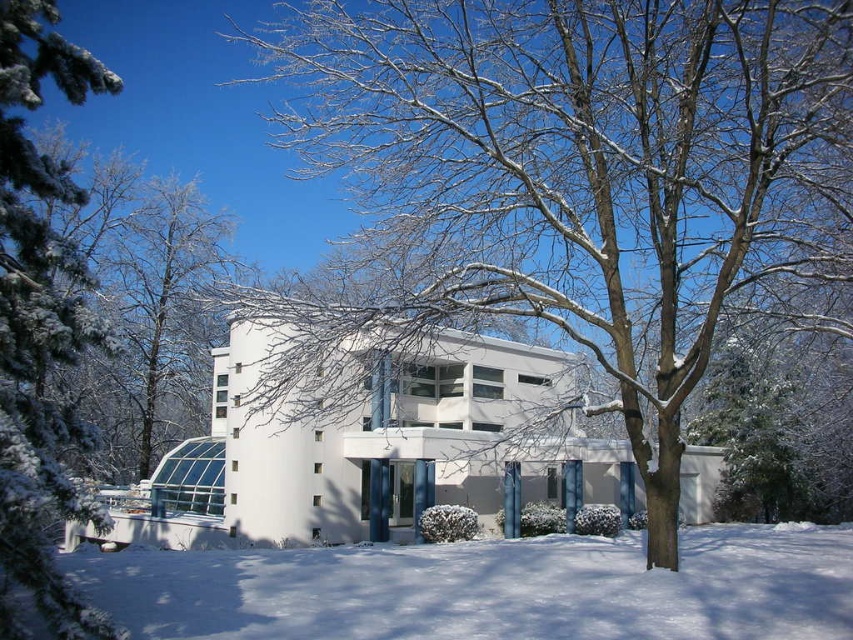
Find the location of `snow-covered tree at center`. snow-covered tree at center is located at coordinates (560, 182).

Who is higher up, snow-covered tree at center or white powdery snow at lower center?

snow-covered tree at center is above.

Does point (457, 88) lie in front of point (289, 568)?

No.

Image resolution: width=853 pixels, height=640 pixels. I want to click on snow-covered tree at center, so pyautogui.click(x=560, y=182).

Does snow-covered tree at center have a lesser width compared to green textured pine at left?

Correct, snow-covered tree at center's width is less than green textured pine at left's.

Where is `snow-covered tree at center`? snow-covered tree at center is located at coordinates (560, 182).

Between point (489, 282) and point (57, 636), which one is positioned behind?

Point (489, 282)

In order to click on snow-covered tree at center in this screenshot , I will do `click(560, 182)`.

Is white powdery snow at lower center behind snow-covered branches at left?

No, white powdery snow at lower center is closer to the viewer.

Is point (595, 540) positioned before point (209, 346)?

Yes, point (595, 540) is in front of point (209, 346).

The height and width of the screenshot is (640, 853). Find the location of `white powdery snow at lower center`. white powdery snow at lower center is located at coordinates (486, 588).